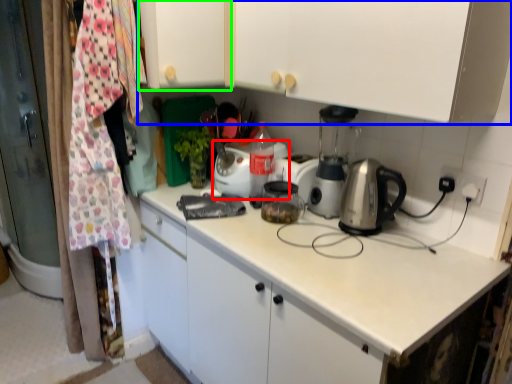
Question: Which is farther away from kitchen appliance (highlighted by a red box)? cabinetry (highlighted by a blue box) or cabinetry (highlighted by a green box)?

Choices:
 (A) cabinetry
 (B) cabinetry

Answer: (A)